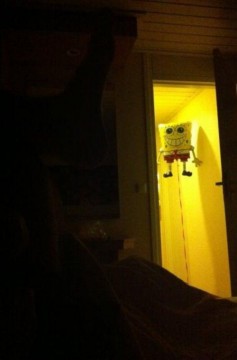
I want to click on white square on wall, so click(x=143, y=186).